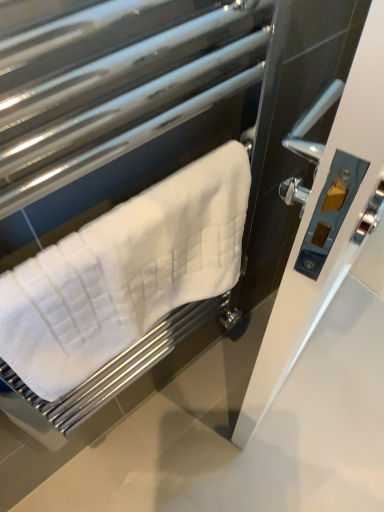
The height and width of the screenshot is (512, 384). Describe the element at coordinates (125, 273) in the screenshot. I see `white textured towel at left` at that location.

Where is `white textured towel at left`? This screenshot has width=384, height=512. white textured towel at left is located at coordinates (125, 273).

Locate an element on the screen. This screenshot has height=512, width=384. white textured towel at left is located at coordinates (125, 273).